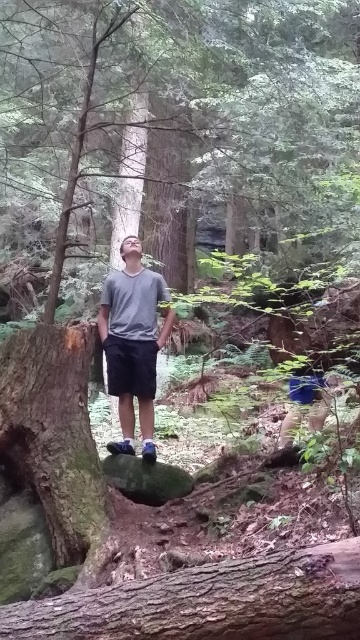
You are a hiker who wants to lean against a tree trunk. You see the brown rough bark tree trunk at lower center and the smooth brown tree trunk at left. Which one is closer to your right side?

The brown rough bark tree trunk at lower center is to the right of the smooth brown tree trunk at left, so if you are facing the scene, the brown rough bark tree trunk at lower center would be closer to your right side.

You are a hiker who wants to cross the forest path. You see the green rough bark tree at center and the brown rough bark tree trunk at lower center. Which tree has a wider trunk?

The green rough bark tree at center has a wider trunk than the brown rough bark tree trunk at lower center according to the description.